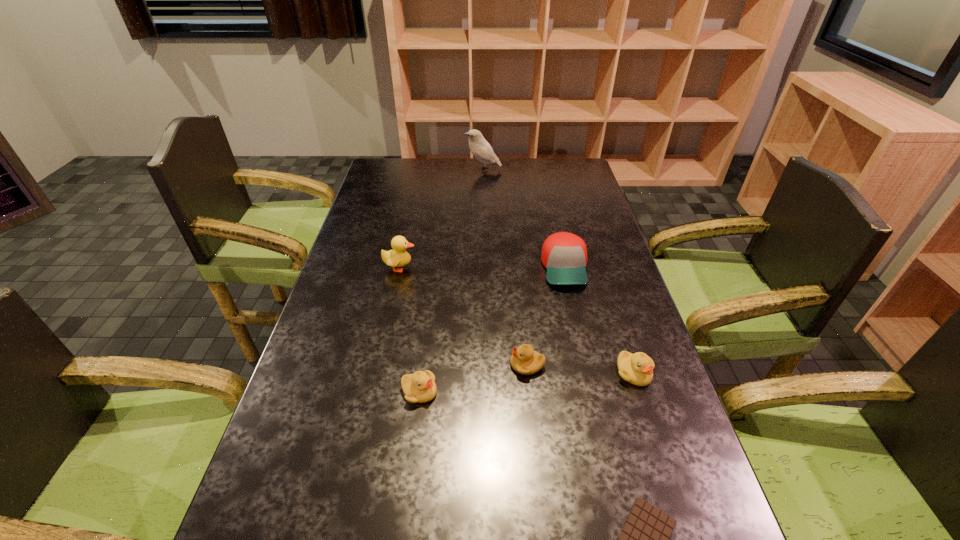
I want to click on blank area located 0.250m at the beak of the bird, so click(x=403, y=170).

The height and width of the screenshot is (540, 960). Identify the location of blank space located 0.320m on the front-facing side of the leftmost duckling. (523, 267).

Where is `vacant space located 0.050m at the brim of the baseball cap`? vacant space located 0.050m at the brim of the baseball cap is located at coordinates (573, 304).

Find the location of a particular element. blank area located 0.220m on the front-facing side of the rightmost duckling is located at coordinates (670, 485).

The height and width of the screenshot is (540, 960). I want to click on vacant space located 0.360m on the front-facing side of the third duckling from right to left, so click(x=596, y=392).

The image size is (960, 540). Find the location of `vacant space located 0.080m on the front-facing side of the third duckling from left to right`. vacant space located 0.080m on the front-facing side of the third duckling from left to right is located at coordinates (476, 365).

Find the location of a particular element. vacant space located on the front-facing side of the third duckling from left to right is located at coordinates (410, 365).

You are a GUI agent. You are given a task and a screenshot of the screen. Output one action in this format:
    pyautogui.click(x=<x>, y=<y>)
    Task: Click on the free space located on the front-facing side of the third duckling from left to right
    
    Given the screenshot: What is the action you would take?
    tap(481, 365)

What are the coordinates of `object situated at the far edge` in the screenshot? It's located at (480, 148).

The width and height of the screenshot is (960, 540). I want to click on object that is positioned at the left edge, so click(x=398, y=257).